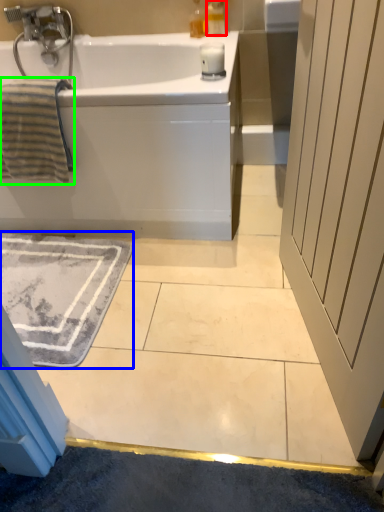
Question: Based on their relative distances, which object is nearer to soap dispenser (highlighted by a red box)? Choose from bath mat (highlighted by a blue box) and bath towel (highlighted by a green box).

Choices:
 (A) bath mat
 (B) bath towel

Answer: (B)